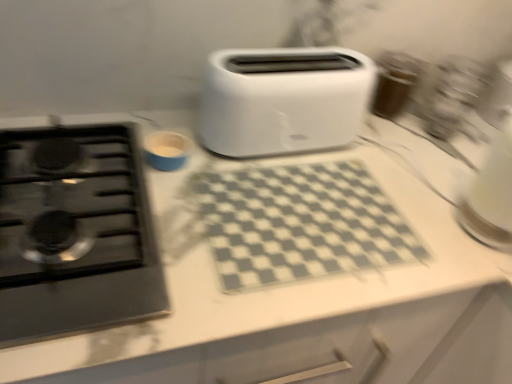
Question: Can you confirm if black glass gas stove at left is positioned to the left of white plastic toaster at center?

Choices:
 (A) yes
 (B) no

Answer: (A)

Question: Is black glass gas stove at left smaller than white plastic toaster at center?

Choices:
 (A) yes
 (B) no

Answer: (A)

Question: Considering the relative positions of black glass gas stove at left and white plastic toaster at center in the image provided, is black glass gas stove at left behind white plastic toaster at center?

Choices:
 (A) no
 (B) yes

Answer: (A)

Question: Are black glass gas stove at left and white plastic toaster at center located far from each other?

Choices:
 (A) no
 (B) yes

Answer: (A)

Question: Is black glass gas stove at left outside of white plastic toaster at center?

Choices:
 (A) no
 (B) yes

Answer: (B)

Question: Is white plastic toaster at center surrounded by black glass gas stove at left?

Choices:
 (A) no
 (B) yes

Answer: (A)

Question: Is white plastic toaster at center next to black glass gas stove at left and touching it?

Choices:
 (A) no
 (B) yes

Answer: (A)

Question: From the image's perspective, is white plastic toaster at center over black glass gas stove at left?

Choices:
 (A) yes
 (B) no

Answer: (A)

Question: Considering the relative sizes of white plastic toaster at center and black glass gas stove at left in the image provided, is white plastic toaster at center bigger than black glass gas stove at left?

Choices:
 (A) no
 (B) yes

Answer: (B)

Question: Is black glass gas stove at left surrounded by white plastic toaster at center?

Choices:
 (A) no
 (B) yes

Answer: (A)

Question: Are white plastic toaster at center and black glass gas stove at left located far from each other?

Choices:
 (A) yes
 (B) no

Answer: (B)

Question: Considering the relative sizes of white plastic toaster at center and black glass gas stove at left in the image provided, is white plastic toaster at center thinner than black glass gas stove at left?

Choices:
 (A) yes
 (B) no

Answer: (A)

Question: Based on their sizes in the image, would you say white plastic toaster at center is bigger or smaller than black glass gas stove at left?

Choices:
 (A) small
 (B) big

Answer: (B)